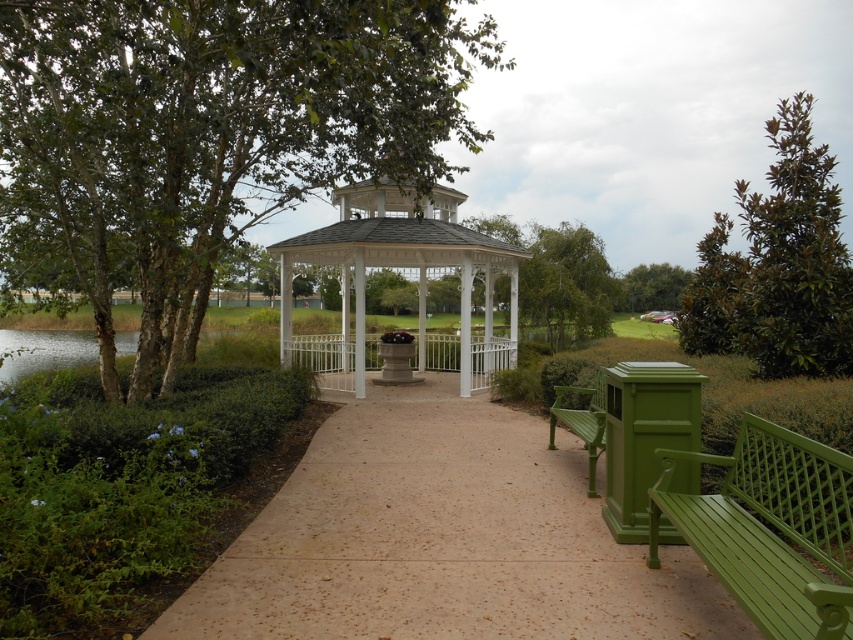
Question: Is green painted wood bench at lower right further to camera compared to green leafy tree at upper center?

Choices:
 (A) no
 (B) yes

Answer: (A)

Question: Is green wooden bench at lower right in front of green leafy tree at upper center?

Choices:
 (A) no
 (B) yes

Answer: (B)

Question: Which object is farther from the camera taking this photo?

Choices:
 (A) green leafy tree at upper right
 (B) white painted metal gazebo at center
 (C) green painted wood bench at lower right
 (D) green leafy tree at upper center

Answer: (D)

Question: Which is farther from the brown concrete path at center?

Choices:
 (A) green leafy tree at center
 (B) green wooden bench at lower right
 (C) white painted metal gazebo at center

Answer: (A)

Question: Estimate the real-world distances between objects in this image. Which object is farther from the green painted wood bench at lower right?

Choices:
 (A) brown concrete path at center
 (B) white painted metal gazebo at center
 (C) green leafy tree at upper left

Answer: (B)

Question: Can you confirm if brown concrete path at center is thinner than green leafy tree at upper center?

Choices:
 (A) yes
 (B) no

Answer: (B)